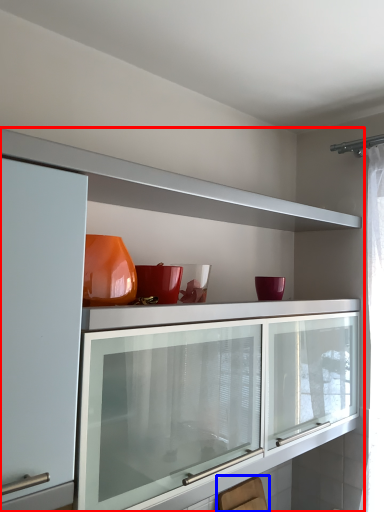
Question: Which object is closer to the camera taking this photo, cabinetry (highlighted by a red box) or swivel chair (highlighted by a blue box)?

Choices:
 (A) cabinetry
 (B) swivel chair

Answer: (A)